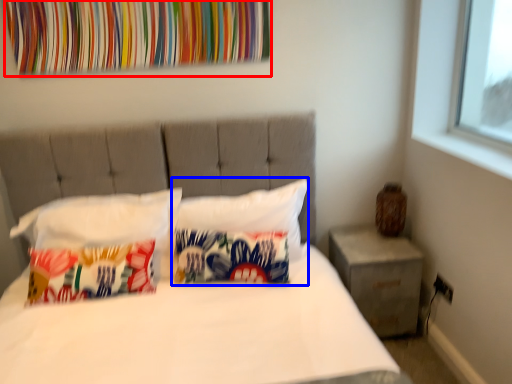
Question: Which object is further to the camera taking this photo, tapestry (highlighted by a red box) or pillow (highlighted by a blue box)?

Choices:
 (A) tapestry
 (B) pillow

Answer: (B)